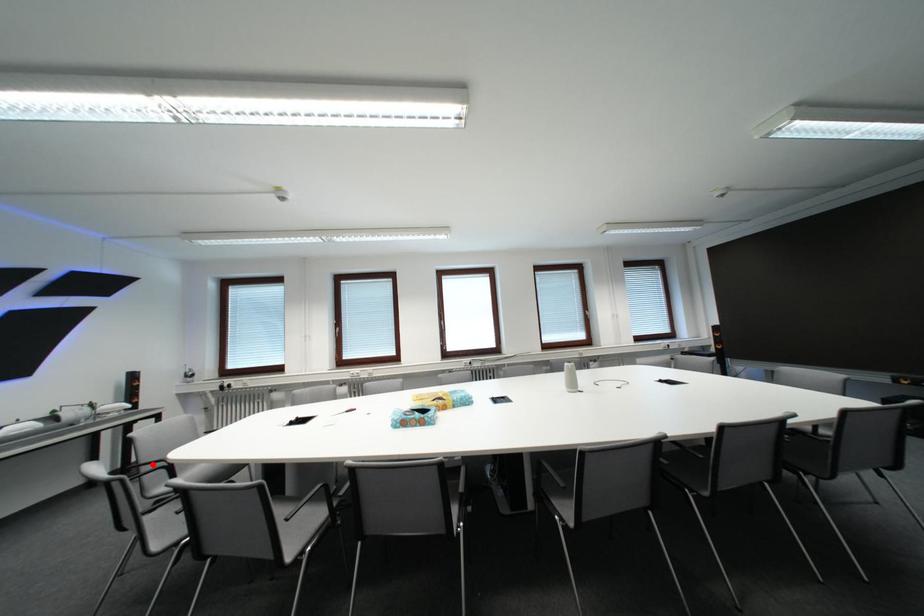
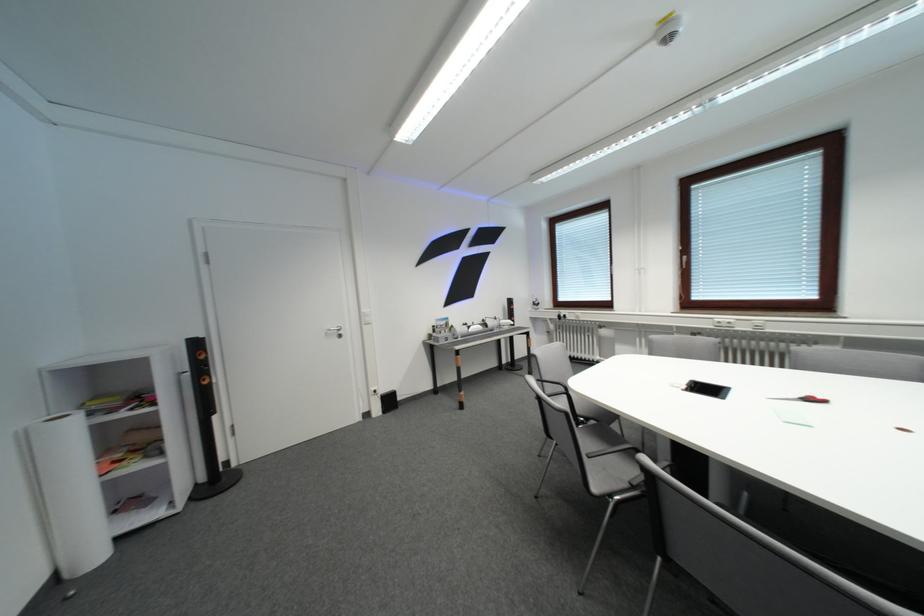
Question: A red point is marked in image1. In image2, is the corresponding 3D point closer to the camera or farther? Reply with the corresponding letter.

Choices:
 (A) The corresponding 3D point is closer.
 (B) The corresponding 3D point is farther.

Answer: (A)